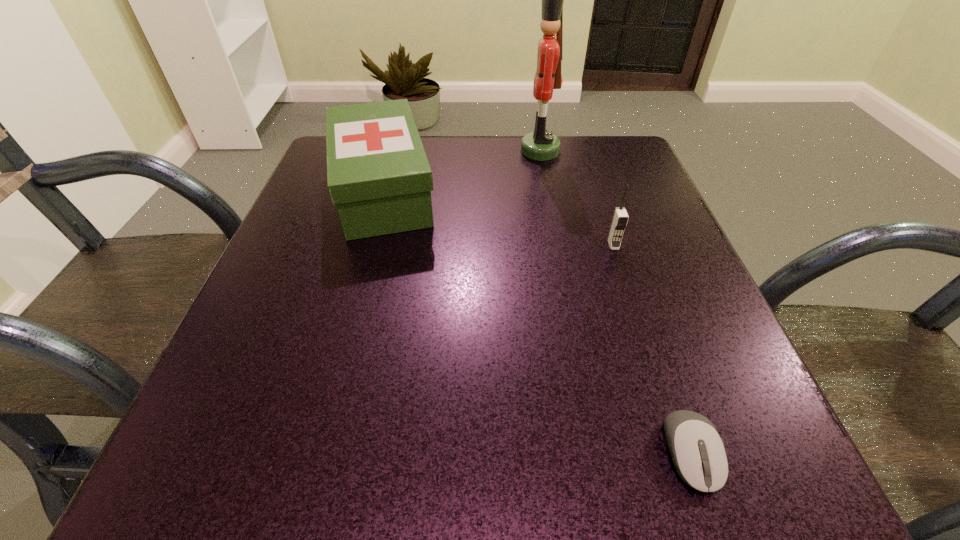
You are a GUI agent. You are given a task and a screenshot of the screen. Output one action in this format:
    pyautogui.click(x=<x>, y=<y>)
    Task: Click on the free space between the tallest object and the nearest object
    
    Given the screenshot: What is the action you would take?
    pyautogui.click(x=615, y=302)

At what (x,y) coordinates should I click in order to perform the action: click on free space between the nutcracker and the nearest object. Please return your answer as a coordinate pair (x, y). This screenshot has height=540, width=960. Looking at the image, I should click on (615, 302).

The image size is (960, 540). I want to click on empty space between the cellular telephone and the second object from left to right, so click(577, 198).

Locate an element on the screen. This screenshot has width=960, height=540. free space between the first-aid kit and the cellular telephone is located at coordinates (498, 218).

The height and width of the screenshot is (540, 960). I want to click on vacant area that lies between the second object from left to right and the nearest object, so click(615, 302).

This screenshot has height=540, width=960. I want to click on free space between the cellular telephone and the nutcracker, so click(577, 198).

Image resolution: width=960 pixels, height=540 pixels. What are the coordinates of `object that stands as the third closest to the nutcracker` in the screenshot? It's located at (698, 453).

Select which object is the closest to the cellular telephone. Please provide its 2D coordinates. Your answer should be formatted as a tuple, i.e. [(x, y)], where the tuple contains the x and y coordinates of a point satisfying the conditions above.

[(541, 145)]